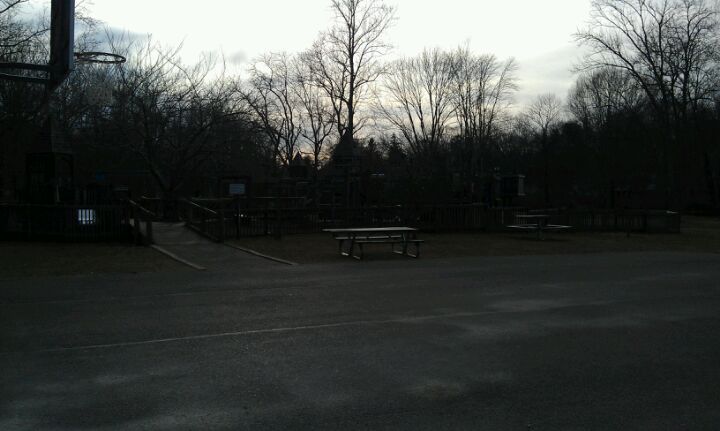
Where is `bench`? This screenshot has height=431, width=720. bench is located at coordinates (374, 252).